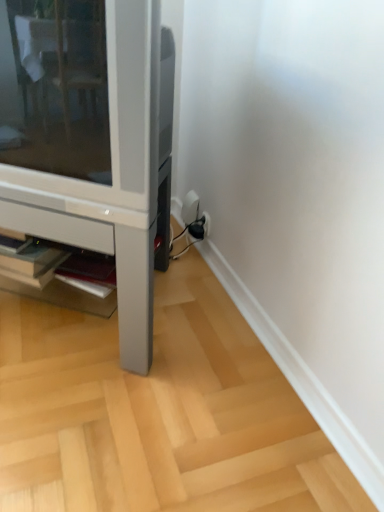
Question: Is matte white shelf at lower center bigger or smaller than satin silver tv stand at lower left?

Choices:
 (A) big
 (B) small

Answer: (B)

Question: Is point (21, 248) positioned closer to the camera than point (144, 366)?

Choices:
 (A) farther
 (B) closer

Answer: (A)

Question: Relative to satin silver tv stand at lower left, is matte white shelf at lower center in front or behind?

Choices:
 (A) front
 (B) behind

Answer: (B)

Question: From their relative heights in the image, would you say satin silver tv stand at lower left is taller or shorter than matte white shelf at lower center?

Choices:
 (A) tall
 (B) short

Answer: (A)

Question: In terms of width, does satin silver tv stand at lower left look wider or thinner when compared to matte white shelf at lower center?

Choices:
 (A) thin
 (B) wide

Answer: (B)

Question: From the image's perspective, is satin silver tv stand at lower left located above or below matte white shelf at lower center?

Choices:
 (A) above
 (B) below

Answer: (A)

Question: Based on their sizes in the image, would you say satin silver tv stand at lower left is bigger or smaller than matte white shelf at lower center?

Choices:
 (A) small
 (B) big

Answer: (B)